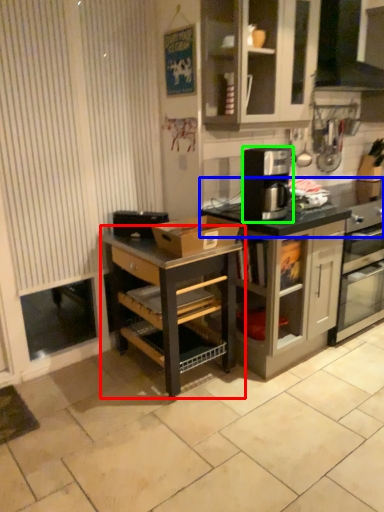
Question: Which is farther away from shelf (highlighted by a red box)? countertop (highlighted by a blue box) or kitchen appliance (highlighted by a green box)?

Choices:
 (A) countertop
 (B) kitchen appliance

Answer: (A)